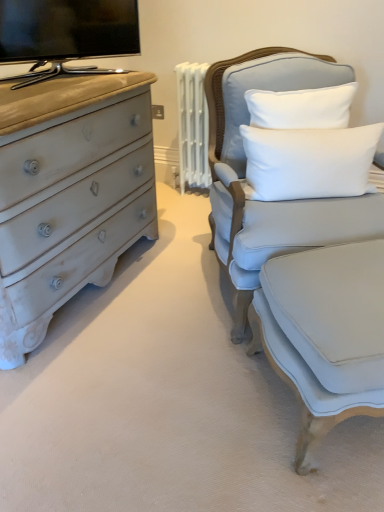
Question: Is light gray fabric chair at right thinner than flat-screen tv at upper left?

Choices:
 (A) yes
 (B) no

Answer: (B)

Question: Is light gray fabric chair at right touching flat-screen tv at upper left?

Choices:
 (A) no
 (B) yes

Answer: (A)

Question: Does light gray fabric chair at right have a smaller size compared to flat-screen tv at upper left?

Choices:
 (A) no
 (B) yes

Answer: (A)

Question: Does light gray fabric chair at right have a greater width compared to flat-screen tv at upper left?

Choices:
 (A) yes
 (B) no

Answer: (A)

Question: Can you confirm if light gray fabric chair at right is positioned to the right of flat-screen tv at upper left?

Choices:
 (A) no
 (B) yes

Answer: (B)

Question: Does point click(377, 276) appear closer or farther from the camera than point click(228, 98)?

Choices:
 (A) farther
 (B) closer

Answer: (B)

Question: Looking at the image, does light blue fabric swivel chair at right seem bigger or smaller compared to light gray fabric chair at right?

Choices:
 (A) small
 (B) big

Answer: (A)

Question: Is light blue fabric swivel chair at right in front of or behind light gray fabric chair at right in the image?

Choices:
 (A) behind
 (B) front

Answer: (B)

Question: Is light blue fabric swivel chair at right inside or outside of light gray fabric chair at right?

Choices:
 (A) inside
 (B) outside

Answer: (B)

Question: Would you say light gray fabric chair at right is to the left or to the right of white soft cushion at upper right in the picture?

Choices:
 (A) left
 (B) right

Answer: (A)

Question: From a real-world perspective, is light gray fabric chair at right above or below white soft cushion at upper right?

Choices:
 (A) above
 (B) below

Answer: (B)

Question: Is light gray fabric chair at right in front of or behind white soft cushion at upper right in the image?

Choices:
 (A) behind
 (B) front

Answer: (B)

Question: Considering the positions of light gray fabric chair at right and white soft cushion at upper right in the image, is light gray fabric chair at right wider or thinner than white soft cushion at upper right?

Choices:
 (A) thin
 (B) wide

Answer: (B)

Question: In the image, is light gray fabric chair at right positioned in front of or behind flat-screen tv at upper left?

Choices:
 (A) behind
 (B) front

Answer: (B)

Question: Is light gray fabric chair at right inside or outside of flat-screen tv at upper left?

Choices:
 (A) outside
 (B) inside

Answer: (A)